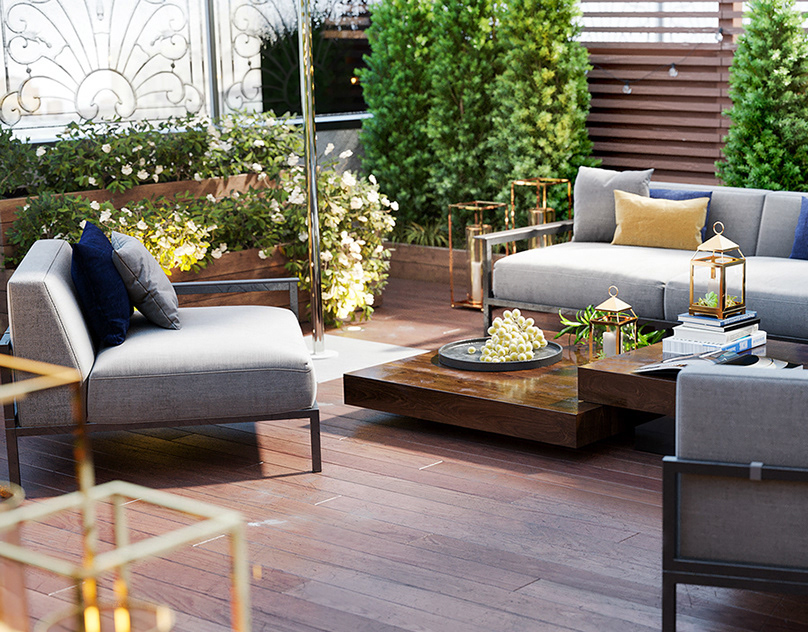
Where is `cushions throw`? Image resolution: width=808 pixels, height=632 pixels. cushions throw is located at coordinates (98, 276), (141, 270), (668, 229), (599, 169), (691, 189).